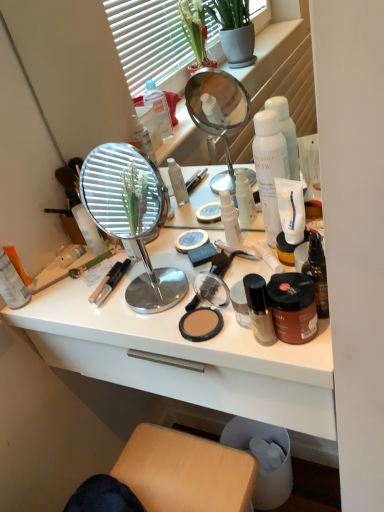
The height and width of the screenshot is (512, 384). I want to click on vacant space in between matte black compact at center and orange matte lotion at left, positioned as the first toiletry in left-to-right order, so click(x=105, y=316).